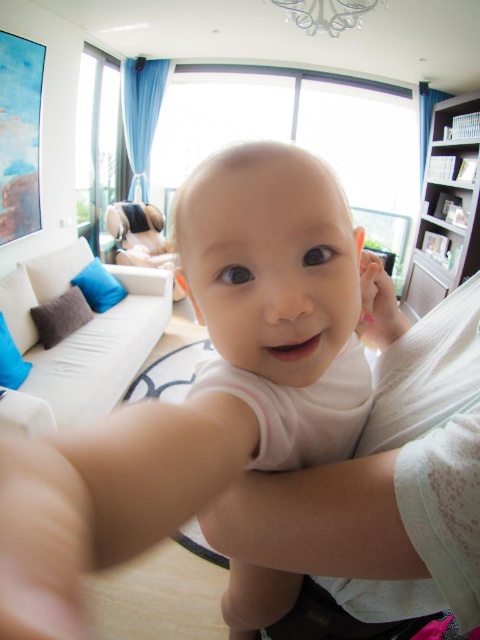
How much distance is there between white soft baby at center and pink matte hand at center?

They are 10.61 inches apart.

Can you confirm if white soft baby at center is positioned below pink matte hand at center?

Correct, white soft baby at center is located below pink matte hand at center.

Image resolution: width=480 pixels, height=640 pixels. What are the coordinates of `white soft baby at center` in the screenshot? It's located at 111,499.

The image size is (480, 640). I want to click on white soft baby at center, so (x=111, y=499).